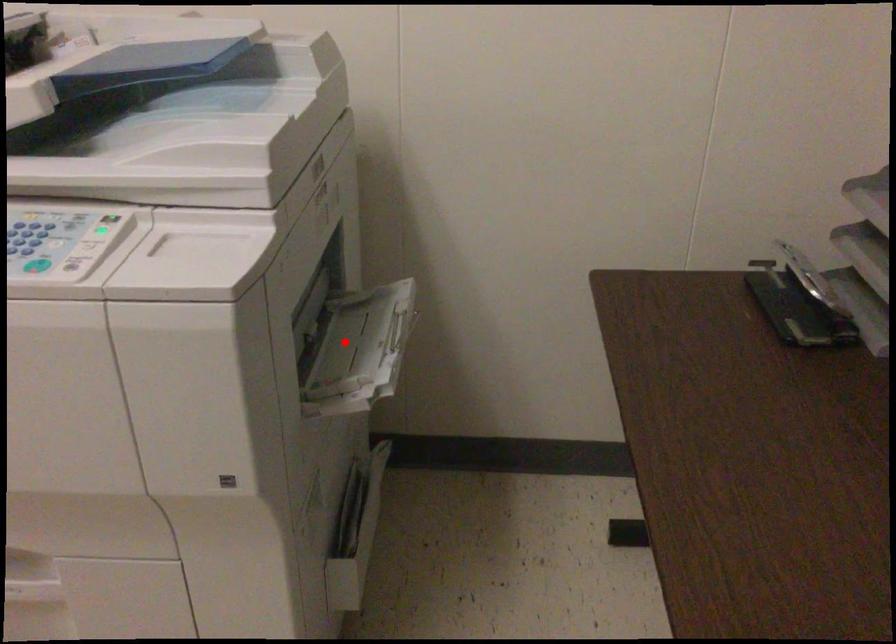
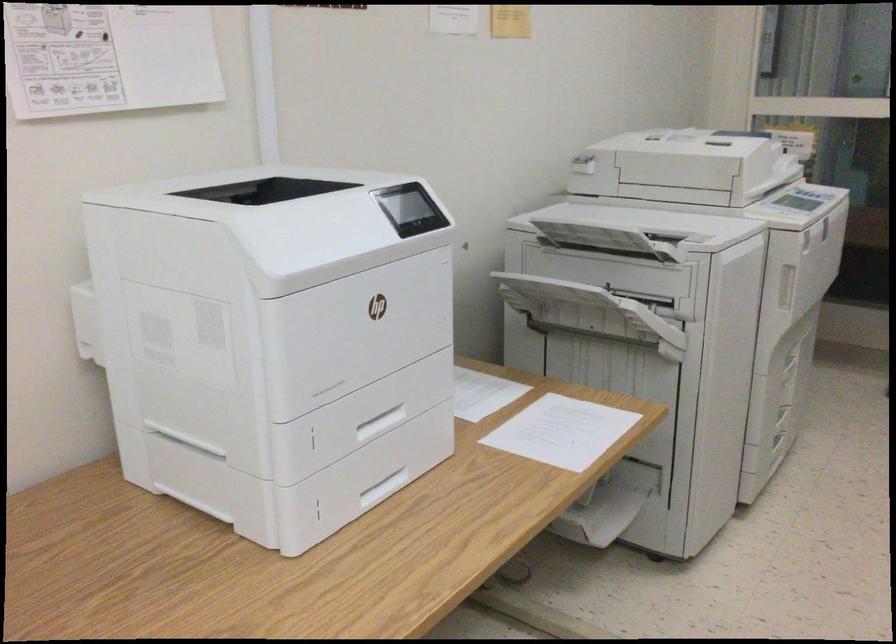
Question: I am providing you with two images of the same scene from different viewpoints. A red point is marked on the first image. Is the red point's position out of view in image 2?

Choices:
 (A) Yes
 (B) No

Answer: (A)